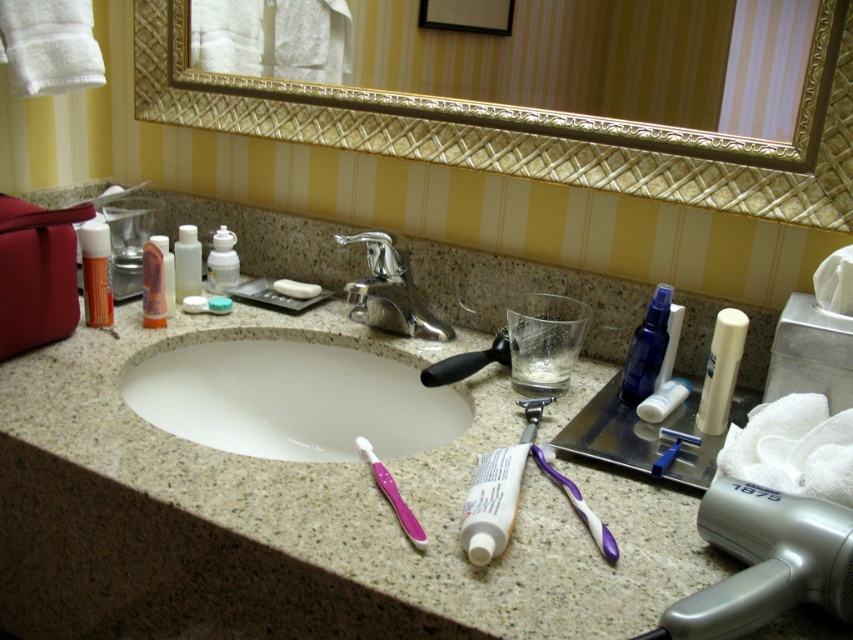
You are organizing the bathroom vanity. You need to place the translucent plastic bottle at left on the countertop. Considering the size of the gold textured mirror at upper center, will there be enough space to place the bottle without blocking the mirror?

The gold textured mirror at upper center is larger in size than the translucent plastic bottle at left. Since the mirror is already placed at the upper center, there should be sufficient space on the countertop to place the translucent plastic bottle at left without blocking the mirror, as the bottle is smaller in size.

Looking at this image, you are standing in front of the bathroom vanity and want to place a new item exactly at point (497, 492). According to the image, what object is currently located at that point?

The point (497, 492) is on the white matte toothpaste at center, so the object currently at that point is the white matte toothpaste at center.

What are the coordinates of the white glossy sink at center?

The white glossy sink at center is located at coordinates point (291, 400).